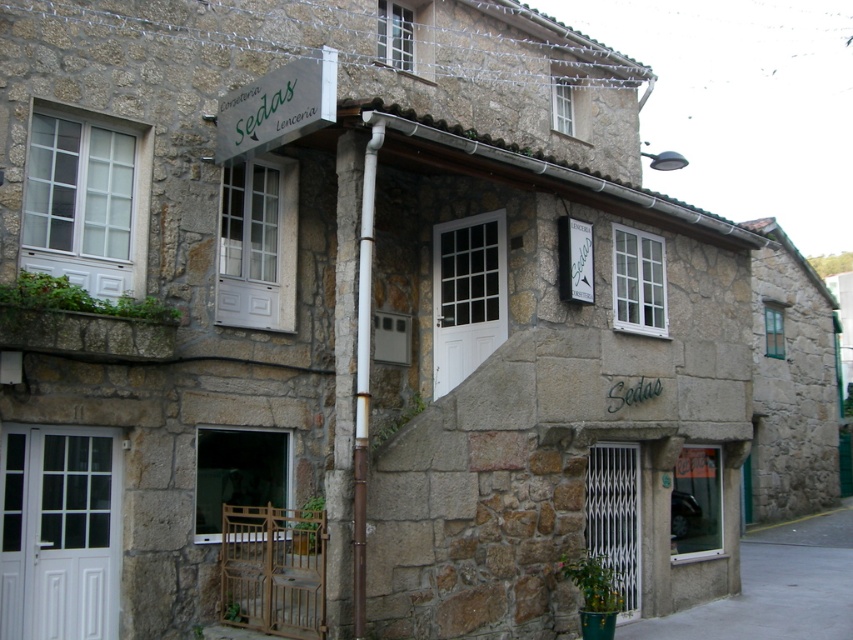
Question: Can you confirm if brown stone pillar at center is smaller than white glossy pipe at center?

Choices:
 (A) no
 (B) yes

Answer: (A)

Question: Which point appears farthest from the camera in this image?

Choices:
 (A) (364, 376)
 (B) (343, 152)

Answer: (B)

Question: Is brown stone pillar at center positioned behind white glossy pipe at center?

Choices:
 (A) yes
 (B) no

Answer: (A)

Question: Which point is farther from the camera taking this photo?

Choices:
 (A) (357, 584)
 (B) (370, 125)

Answer: (B)

Question: Is brown stone pillar at center bigger than white glossy pipe at center?

Choices:
 (A) no
 (B) yes

Answer: (B)